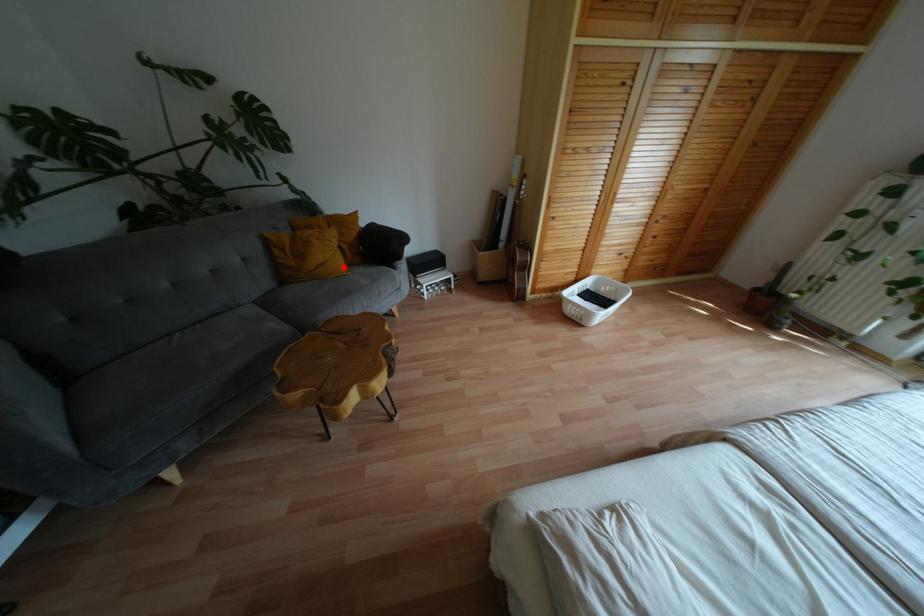
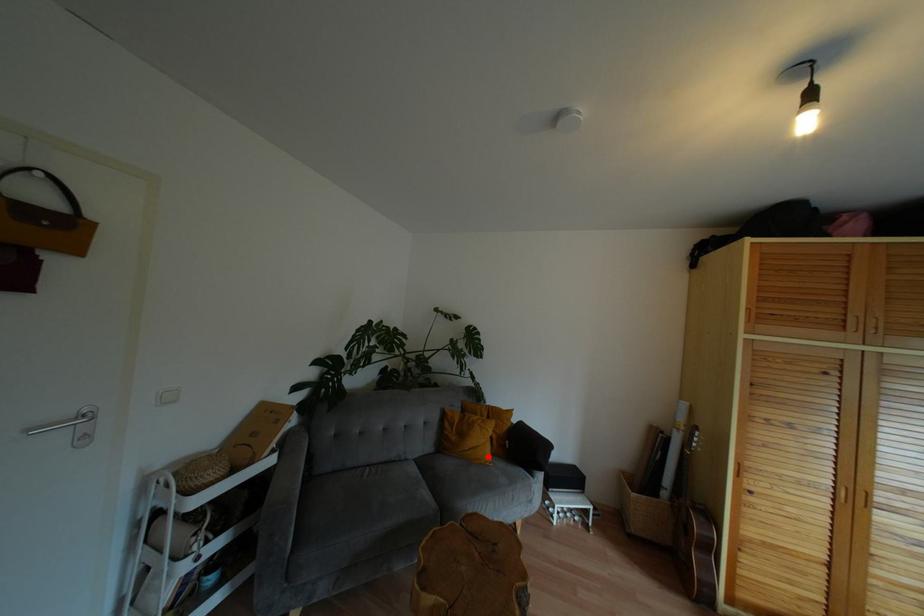
I am providing you with two images of the same scene from different viewpoints. A red point is marked on the first image and another point is marked on the second image. Do the highlighted points in image1 and image2 indicate the same real-world spot?

Yes